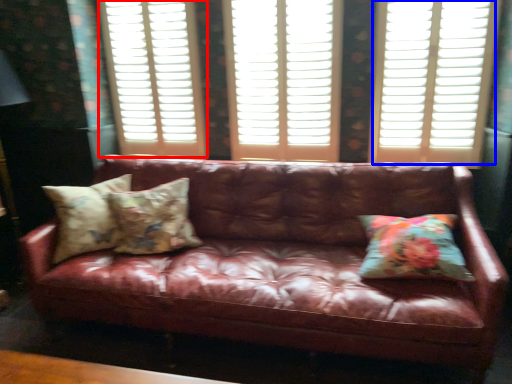
Question: Which point is further to the camera, window frame (highlighted by a red box) or window (highlighted by a blue box)?

Choices:
 (A) window frame
 (B) window

Answer: (A)